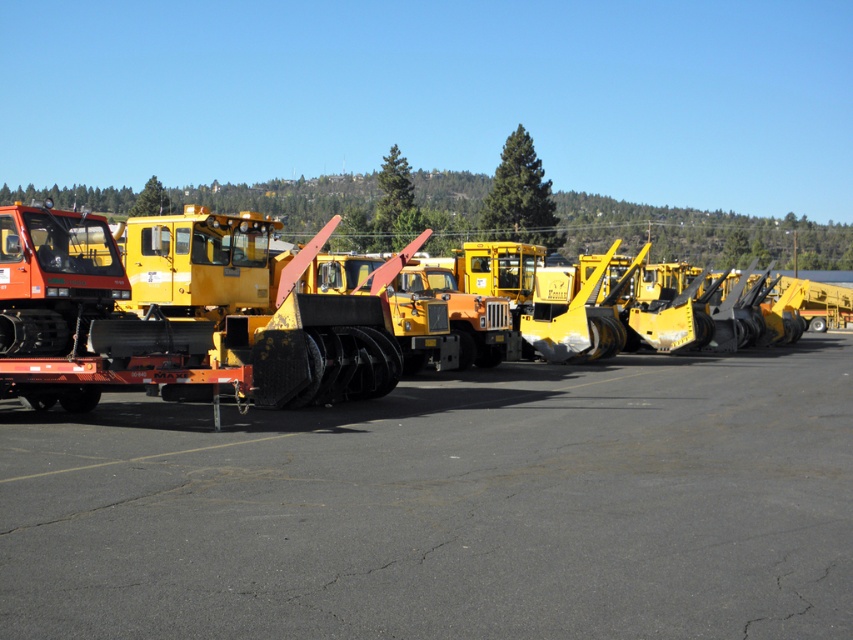
You are a delivery driver who needs to park your truck between the black asphalt at center and the matte black snowplow at left. Can you fit your truck there if your truck is 6 meters long?

The black asphalt at center is smaller than the matte black snowplow at left. Since the truck is 6 meters long, you need to check the available space between them. However, the description only states their size comparison, not the exact dimensions. Without knowing the exact size of the asphalt or the snowplow, it is impossible to determine if the truck will fit.

You are a surveyor using a coordinate system where the bottom left corner is the origin. You need to locate the black asphalt at center in the image. What are its coordinates?

The coordinates of the black asphalt at center are at point (448, 508).

You are a delivery driver who needs to park your truck between the black asphalt at center and the matte black snowplow at left. The truck is 2 meters long. Can you safely park your truck in that space without overlapping either object?

The distance between the black asphalt at center and the matte black snowplow at left is 2.57 meters. Since the truck is 2 meters long, there is enough space to park safely without overlapping either object.